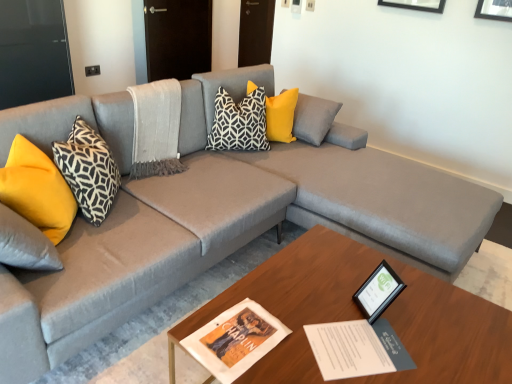
This screenshot has width=512, height=384. In order to click on empty space that is ontop of white paper booklet at center in this screenshot , I will do 355,341.